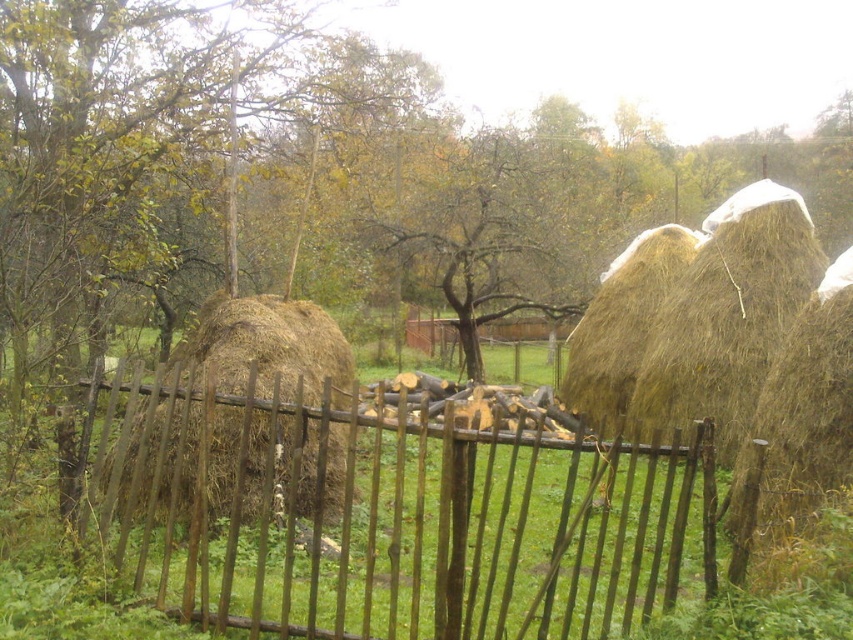
Between point (381, 564) and point (544, 264), which one is positioned behind?

Positioned behind is point (544, 264).

Does point (613, 532) come behind point (480, 307)?

No, (613, 532) is in front of (480, 307).

Is point (639, 493) less distant than point (463, 337)?

Yes, it is in front of point (463, 337).

What are the coordinates of `brown wooden fence at center` in the screenshot? It's located at (386, 512).

Between brown rough hay at left and golden straw bale at center, which one appears on the right side from the viewer's perspective?

From the viewer's perspective, golden straw bale at center appears more on the right side.

Between point (335, 426) and point (625, 348), which one is positioned in front?

Point (335, 426) is more forward.

Is point (253, 337) positioned before point (596, 372)?

Yes, it is in front of point (596, 372).

Where is `brown rough hay at left`? The width and height of the screenshot is (853, 640). brown rough hay at left is located at coordinates (268, 349).

Is yellow-green foliage at center in front of golden straw bale at center?

No, it is behind golden straw bale at center.

Is yellow-green foliage at center smaller than golden straw bale at center?

No.

Identify the location of yellow-green foliage at center. This screenshot has height=640, width=853. (486, 234).

The image size is (853, 640). In order to click on yellow-green foliage at center in this screenshot , I will do `click(486, 234)`.